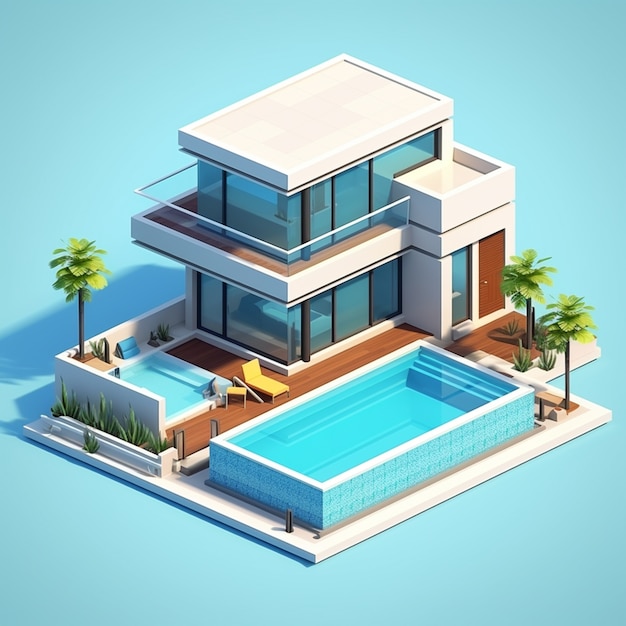
Locate an element on the screen. This screenshot has width=626, height=626. door is located at coordinates (489, 260).